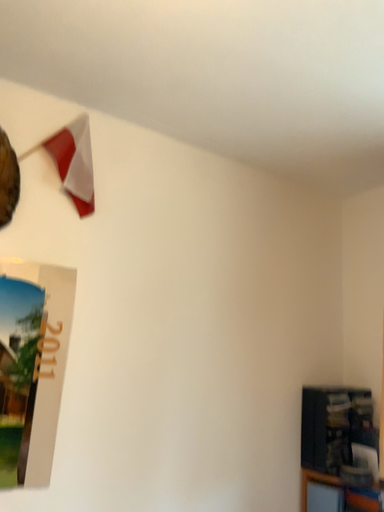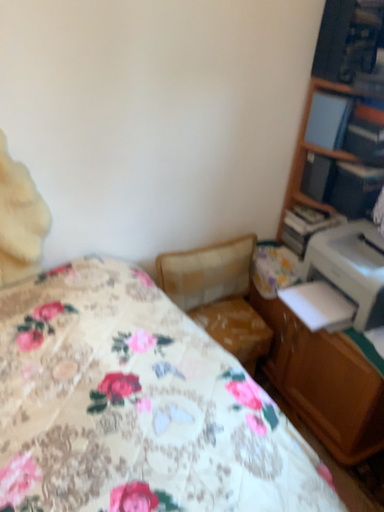
Question: Which way did the camera rotate in the video?

Choices:
 (A) rotated upward
 (B) rotated downward

Answer: (B)